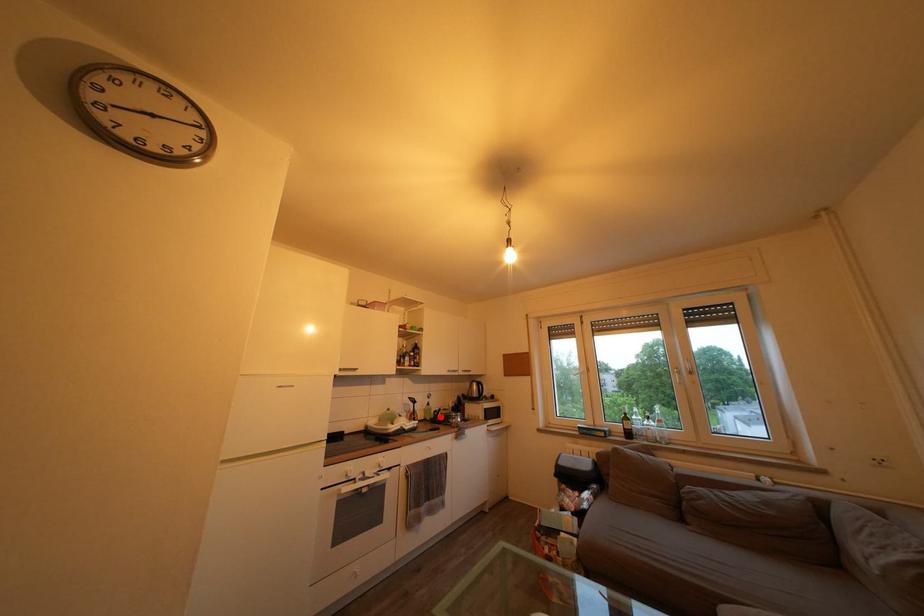
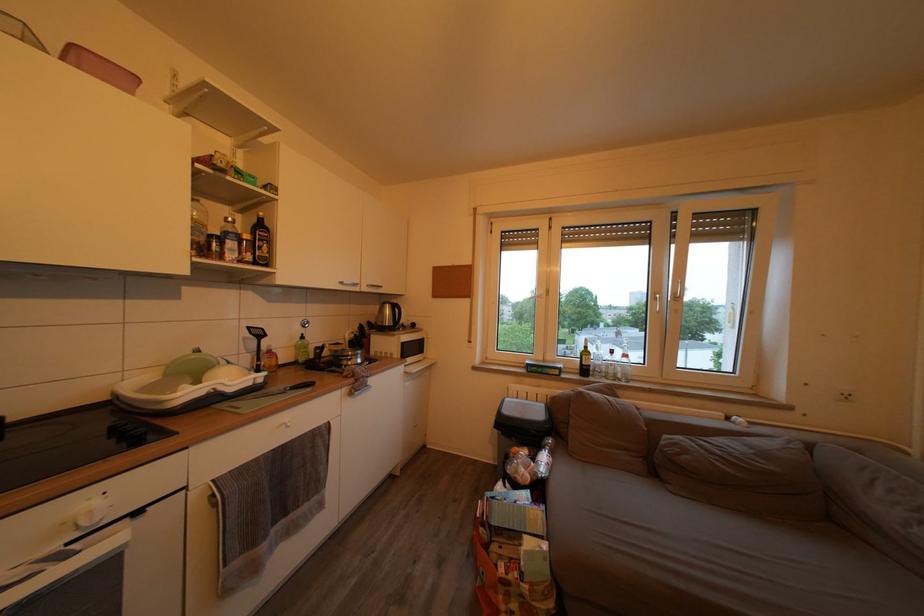
In the second image, find the point that corresponds to the highlighted location in the first image.

(320, 353)